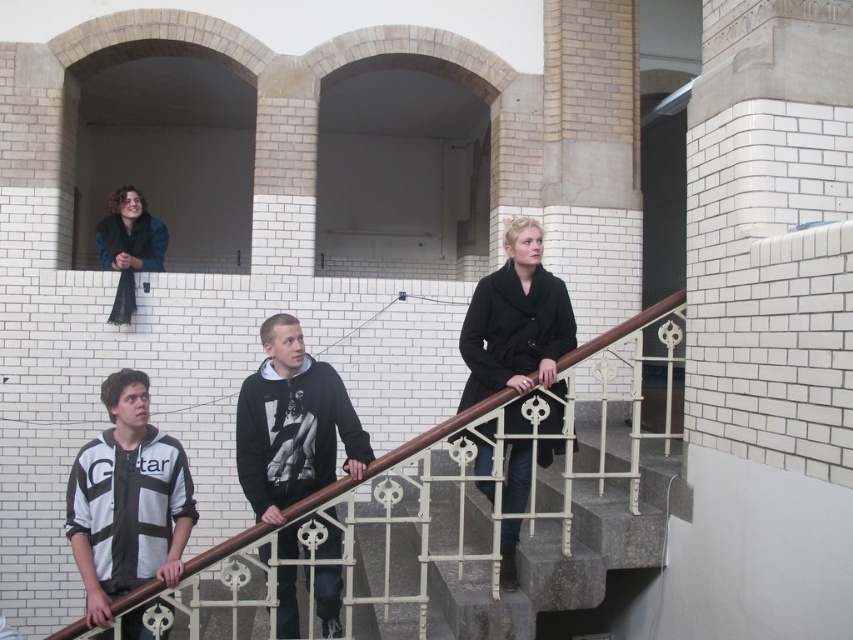
You are standing at the bottom of the staircase and want to hand a note to both the person in the black hoodie at center and the person in the dark blue jacket at upper left. Which person should you approach first if you want to reach the one closer to you?

The black hoodie at center is located below dark blue jacket at upper left, so you should approach the person in the black hoodie at center first since they are closer to you.

You are standing at the bottom of the staircase and want to take a photo of the black hoodie at center. Your camera has a maximum range of 3.5 meters. Can you capture the photo without moving closer?

The black hoodie at center and camera are 3.69 meters apart. Since the camera has a maximum range of 3.5 meters, you cannot capture the photo without moving closer.

Looking at this image, you are standing at the bottom of the staircase and want to pass through between the black hoodie at center and the dark blue jacket at upper left. Given that your body width is 0.5 meters, can you fit through the space between them?

The black hoodie at center is wider than the dark blue jacket at upper left. Since the total width of both objects combined may exceed the available space, it is uncertain whether you can fit through. However, since the question only mentions their widths and not the distance between them, we cannot definitively determine if there is enough space for your 0.5 meters width. More information about the distance between them is needed.